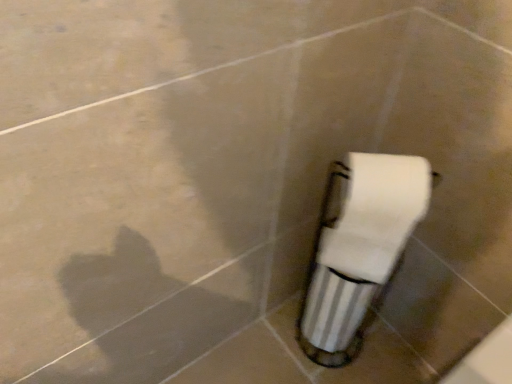
This screenshot has width=512, height=384. What do you see at coordinates (373, 213) in the screenshot?
I see `white paper at center` at bounding box center [373, 213].

This screenshot has height=384, width=512. What are the coordinates of `white paper at center` in the screenshot? It's located at (373, 213).

Locate an element on the screen. white paper at center is located at coordinates (373, 213).